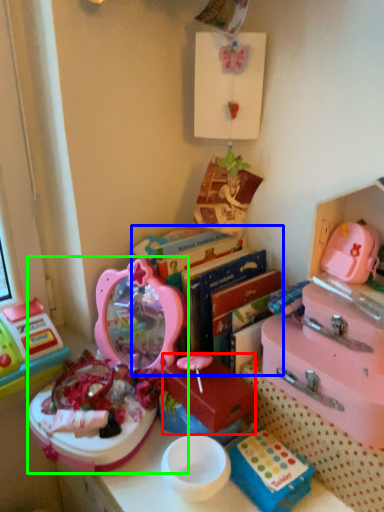
Question: Which object is positioned closest to storage box (highlighted by a red box)? Select from bookshelf (highlighted by a blue box) and toy (highlighted by a green box).

Choices:
 (A) bookshelf
 (B) toy

Answer: (A)